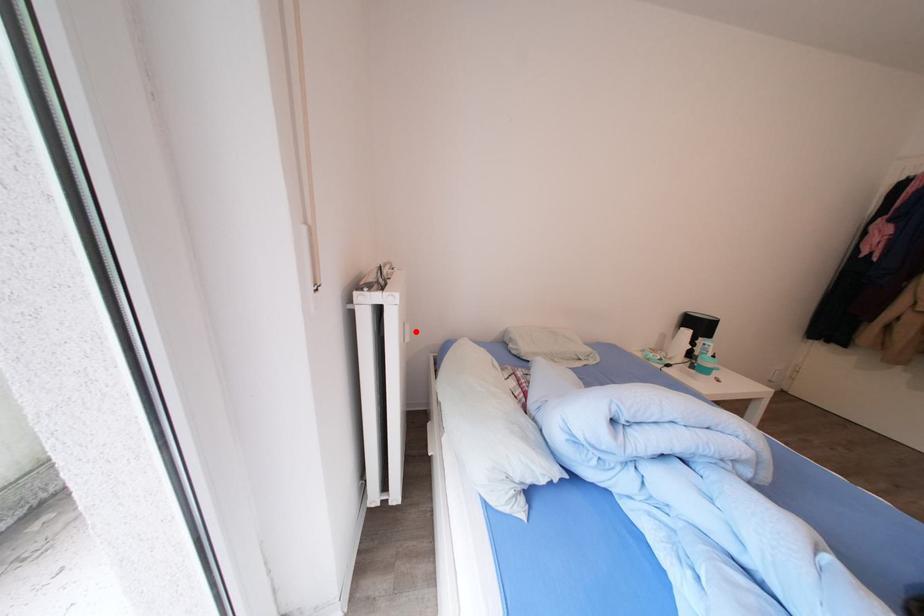
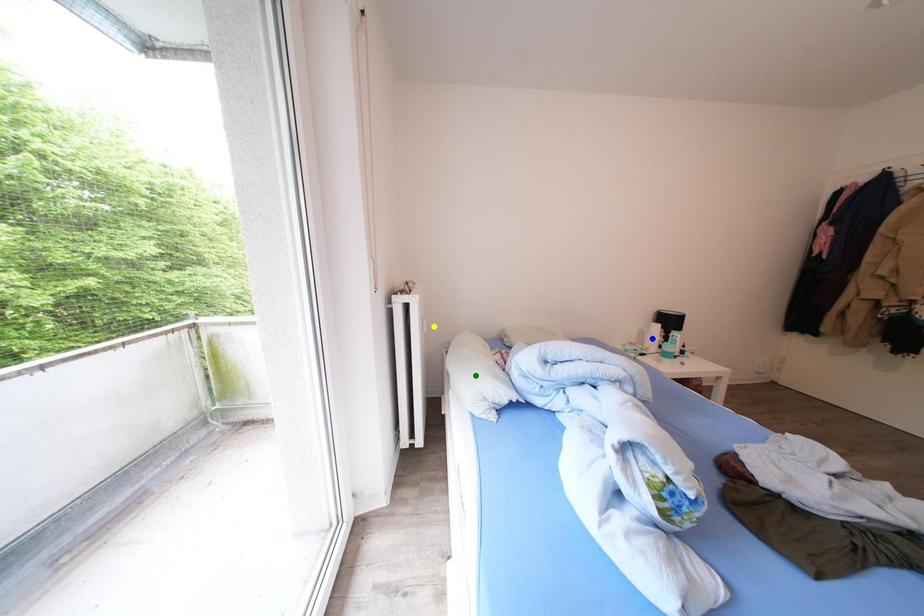
Question: I am providing you with two images of the same scene from different viewpoints. A red point is marked on the first image. You are given multiple points on the second image. In image 2, which mark is for the same physical point as the one in image 1?

Choices:
 (A) blue point
 (B) green point
 (C) yellow point

Answer: (C)